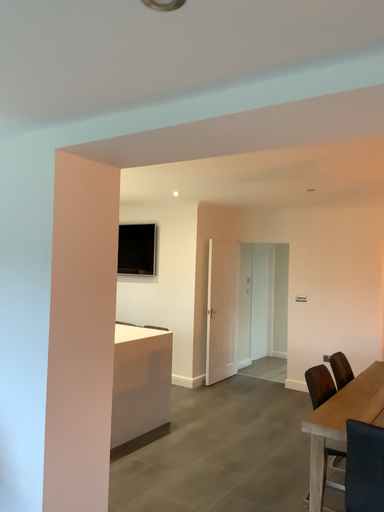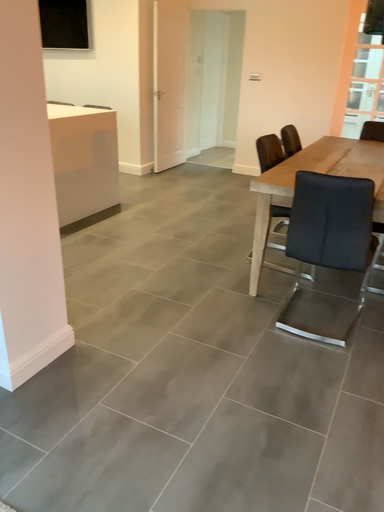
Question: How did the camera likely rotate when shooting the video?

Choices:
 (A) rotated downward
 (B) rotated upward

Answer: (A)